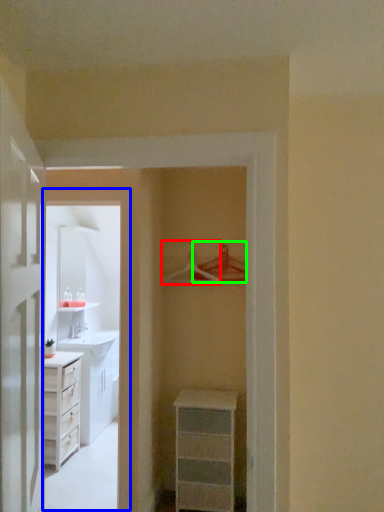
Question: Which object is positioned farthest from hanger (highlighted by a red box)? Select from corridor (highlighted by a blue box) and hanger (highlighted by a green box).

Choices:
 (A) corridor
 (B) hanger

Answer: (A)